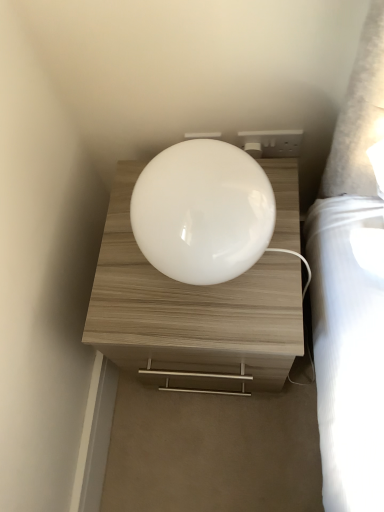
Question: Does white glossy lampshade at center have a lesser height compared to white plastic socket at upper right?

Choices:
 (A) yes
 (B) no

Answer: (B)

Question: Is white glossy lampshade at center oriented away from white plastic socket at upper right?

Choices:
 (A) no
 (B) yes

Answer: (B)

Question: Is white glossy lampshade at center directly adjacent to white plastic socket at upper right?

Choices:
 (A) no
 (B) yes

Answer: (A)

Question: Is white glossy lampshade at center smaller than white plastic socket at upper right?

Choices:
 (A) no
 (B) yes

Answer: (A)

Question: Is the position of white glossy lampshade at center more distant than that of white plastic socket at upper right?

Choices:
 (A) yes
 (B) no

Answer: (B)

Question: From a real-world perspective, is white glossy lampshade at center on white plastic socket at upper right?

Choices:
 (A) yes
 (B) no

Answer: (A)

Question: Is white plastic socket at upper right positioned before white glossy lampshade at center?

Choices:
 (A) yes
 (B) no

Answer: (B)

Question: From the image's perspective, is white plastic socket at upper right on white glossy lampshade at center?

Choices:
 (A) no
 (B) yes

Answer: (B)

Question: Can white glossy lampshade at center be found inside white plastic socket at upper right?

Choices:
 (A) yes
 (B) no

Answer: (B)

Question: From a real-world perspective, is white plastic socket at upper right over white glossy lampshade at center?

Choices:
 (A) yes
 (B) no

Answer: (B)

Question: Is white plastic socket at upper right thinner than white glossy lampshade at center?

Choices:
 (A) yes
 (B) no

Answer: (A)

Question: Can you confirm if white plastic socket at upper right is bigger than white glossy lampshade at center?

Choices:
 (A) no
 (B) yes

Answer: (A)

Question: From the image's perspective, is white glossy lampshade at center above white glossy nightstand at center?

Choices:
 (A) yes
 (B) no

Answer: (A)